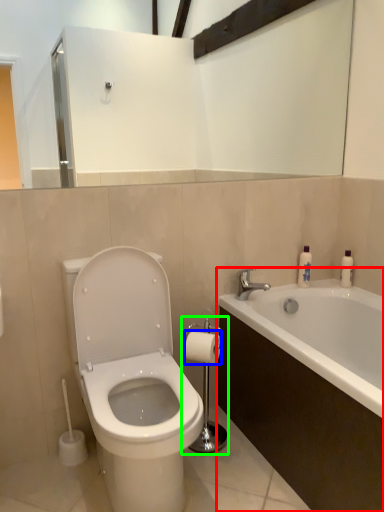
Question: Which object is positioned farthest from bathtub (highlighted by a red box)? Select from toilet paper (highlighted by a blue box) and towel bar (highlighted by a green box).

Choices:
 (A) toilet paper
 (B) towel bar

Answer: (A)